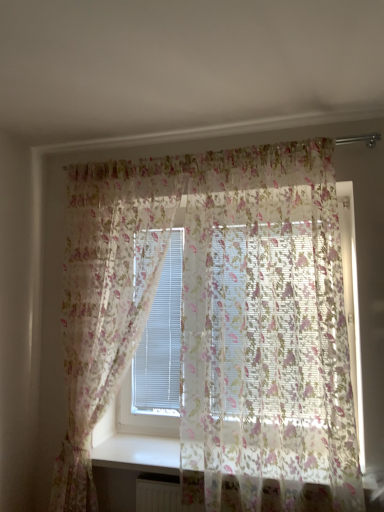
Question: Is translucent floral curtain at upper center, the 1th curtain from the right, taller than translucent floral fabric at center, which is the 2th curtain in right-to-left order?

Choices:
 (A) no
 (B) yes

Answer: (A)

Question: Is translucent floral curtain at upper center, the 1th curtain from the right, in front of translucent floral fabric at center, the 1th curtain viewed from the left?

Choices:
 (A) yes
 (B) no

Answer: (A)

Question: Is translucent floral curtain at upper center, arranged as the second curtain when viewed from the left, positioned with its back to translucent floral fabric at center, the 1th curtain viewed from the left?

Choices:
 (A) yes
 (B) no

Answer: (B)

Question: Is translucent floral curtain at upper center, the 1th curtain from the right, to the right of translucent floral fabric at center, which is the 2th curtain in right-to-left order, from the viewer's perspective?

Choices:
 (A) no
 (B) yes

Answer: (B)

Question: Considering the relative sizes of translucent floral curtain at upper center, the 1th curtain from the right, and translucent floral fabric at center, the 1th curtain viewed from the left, in the image provided, is translucent floral curtain at upper center, the 1th curtain from the right, bigger than translucent floral fabric at center, the 1th curtain viewed from the left,?

Choices:
 (A) yes
 (B) no

Answer: (A)

Question: Can you confirm if translucent floral curtain at upper center, the 1th curtain from the right, is wider than translucent floral fabric at center, which is the 2th curtain in right-to-left order?

Choices:
 (A) yes
 (B) no

Answer: (A)

Question: From the image's perspective, is translucent floral fabric at center, the 1th curtain viewed from the left, under translucent floral curtain at upper center, the 1th curtain from the right?

Choices:
 (A) yes
 (B) no

Answer: (A)

Question: Is translucent floral fabric at center, which is the 2th curtain in right-to-left order, oriented away from translucent floral curtain at upper center, arranged as the second curtain when viewed from the left?

Choices:
 (A) no
 (B) yes

Answer: (A)

Question: Is translucent floral fabric at center, the 1th curtain viewed from the left, behind translucent floral curtain at upper center, arranged as the second curtain when viewed from the left?

Choices:
 (A) no
 (B) yes

Answer: (B)

Question: Can you confirm if translucent floral fabric at center, which is the 2th curtain in right-to-left order, is wider than translucent floral curtain at upper center, the 1th curtain from the right?

Choices:
 (A) no
 (B) yes

Answer: (A)

Question: Can we say translucent floral fabric at center, which is the 2th curtain in right-to-left order, lies outside translucent floral curtain at upper center, the 1th curtain from the right?

Choices:
 (A) yes
 (B) no

Answer: (A)

Question: Is the surface of translucent floral fabric at center, which is the 2th curtain in right-to-left order, in direct contact with translucent floral curtain at upper center, arranged as the second curtain when viewed from the left?

Choices:
 (A) no
 (B) yes

Answer: (A)

Question: Is translucent floral fabric at center, the 1th curtain viewed from the left, inside the boundaries of translucent floral curtain at upper center, the 1th curtain from the right, or outside?

Choices:
 (A) inside
 (B) outside

Answer: (B)